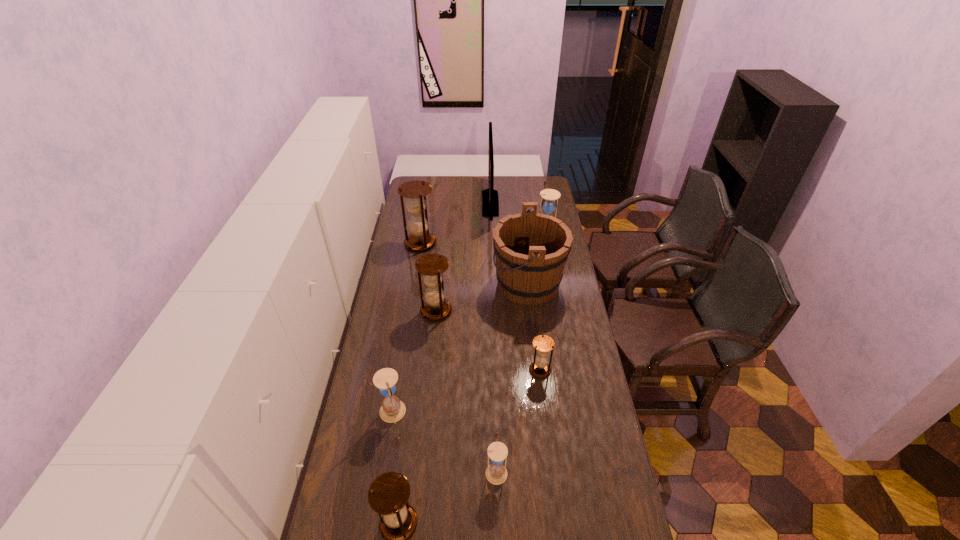
Where is `white hourglass that stands as the closest to the wine bucket`? white hourglass that stands as the closest to the wine bucket is located at coordinates (550, 197).

Identify the location of the closest white hourglass to the monitor. (550, 197).

What are the coordinates of `free space that satisfies the following two spatial constraints: 1. on the front-facing side of the third farthest brown hourglass; 2. on the left side of the monitor` in the screenshot? It's located at (495, 370).

Where is `free space in the image that satisfies the following two spatial constraints: 1. on the front-facing side of the monitor; 2. on the right side of the rightmost white hourglass`? This screenshot has height=540, width=960. free space in the image that satisfies the following two spatial constraints: 1. on the front-facing side of the monitor; 2. on the right side of the rightmost white hourglass is located at coordinates (492, 232).

Where is `vacant space that satisfies the following two spatial constraints: 1. on the front-facing side of the monitor; 2. on the front side of the second white hourglass from left to right`? This screenshot has width=960, height=540. vacant space that satisfies the following two spatial constraints: 1. on the front-facing side of the monitor; 2. on the front side of the second white hourglass from left to right is located at coordinates (499, 471).

Where is `vacant space that satisfies the following two spatial constraints: 1. on the front side of the second nearest object; 2. on the left side of the third farthest hourglass`? This screenshot has width=960, height=540. vacant space that satisfies the following two spatial constraints: 1. on the front side of the second nearest object; 2. on the left side of the third farthest hourglass is located at coordinates (420, 471).